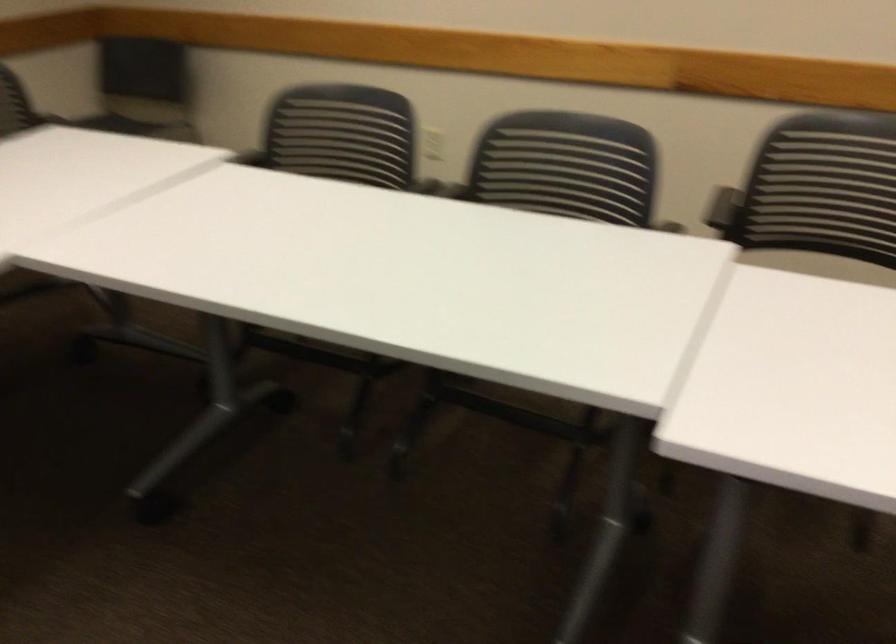
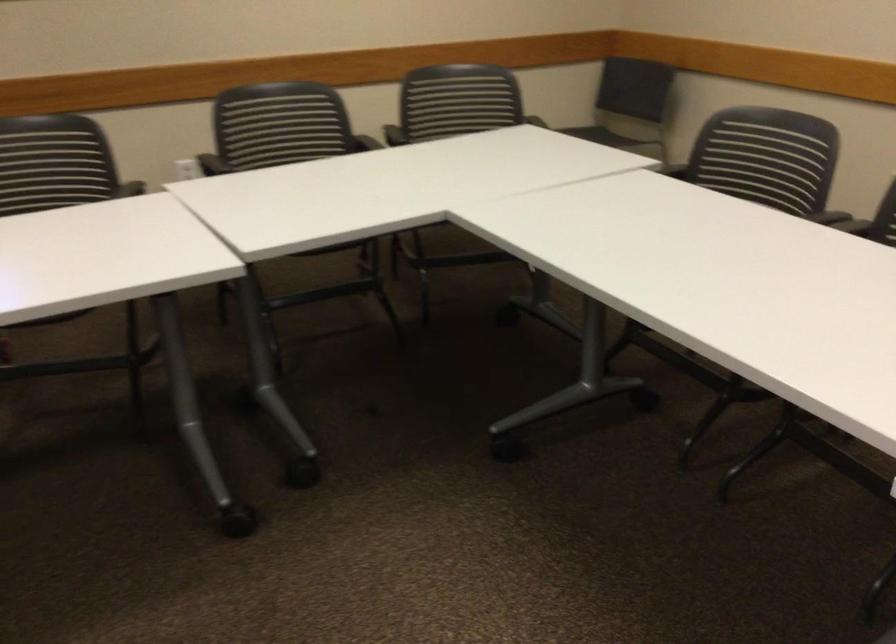
In the second image, find the point that corresponds to the point at 352,133 in the first image.

(767, 156)